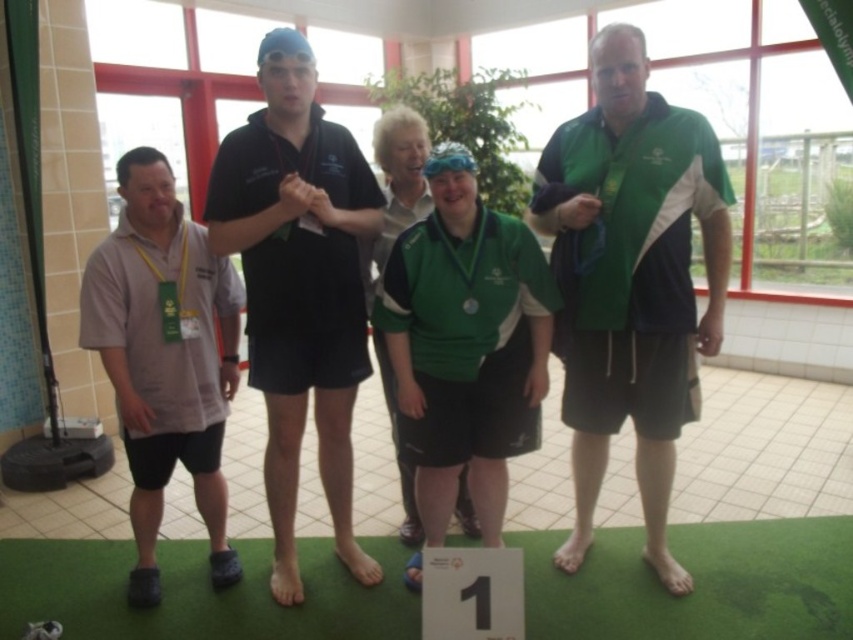
You are a photographer standing in front of the group. You notice the green fabric shirt at center and the black matte shirt at center. Which shirt is closer to you?

The green fabric shirt at center is closer to you because it is positioned further to the viewer than the black matte shirt at center.

Looking at this image, you are standing in the swimming event venue and see the black matte shirt at center. If you want to reach it in 3 seconds, what is the minimum speed you need to move at?

The black matte shirt at center is 2.32 meters away from viewer. To reach it in 3 seconds, the minimum speed required is approximately 0.77 meters per second.

You are organizing a team photo and need to arrange the green fabric shirt at center and the black matte shirt at center so that both are visible. Given their sizes, which shirt should be placed higher to ensure both are fully visible?

The green fabric shirt at center should be placed higher because it has a larger size compared to the black matte shirt at center, allowing both to be fully visible.